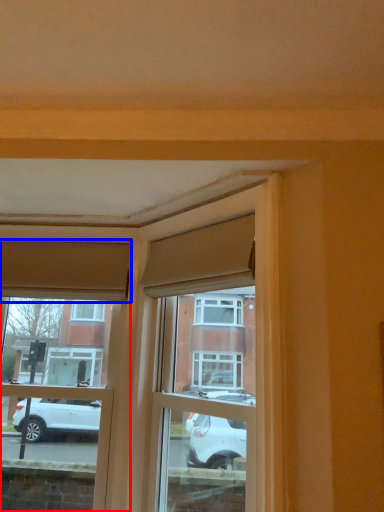
Question: Which object is closer to the camera taking this photo, window (highlighted by a red box) or curtain (highlighted by a blue box)?

Choices:
 (A) window
 (B) curtain

Answer: (A)